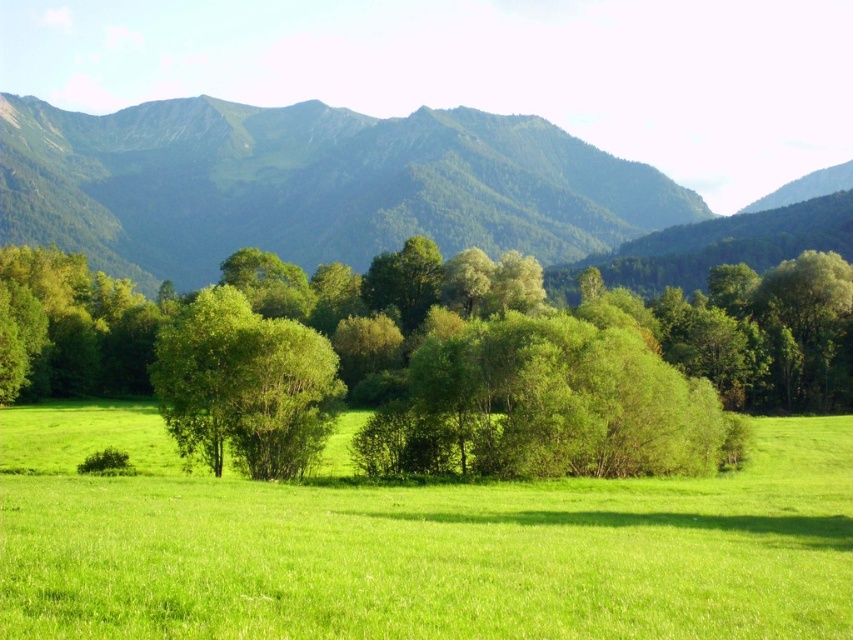
You are standing at the bottom left corner of the image. Looking towards the green leafy tree at center, in which general direction should you walk to reach it? Please choose from north, south, east, or west.

Since the green leafy tree at center is located at coordinates approximately halfway across the image horizontally and slightly below the vertical midpoint, if you are at the bottom left corner, you would need to walk northeast to reach it. However, based on standard image coordinate systems where the origin is typically at the top left, the tree is at x 0.58, y 0.518. In this case, moving from the bottom left corner, which is coordinate approximately near the bottom left, you would move towards the center.

Looking at this image, you are standing in the meadow and want to take a photo of both the green leafy tree at center and the green textured mountain range at upper center. Can you fit both in the frame without moving your camera position?

The green leafy tree at center is not as tall as the green textured mountain range at upper center, so yes, you can fit both in the frame since the tree is shorter and the mountain is taller, allowing them to be captured together.

You are standing at the origin point in the image. A green grass pasture at center is located at point (416, 545). Which direction should you move to reach the green grass pasture at center from your current position?

The green grass pasture at center is located at point (416, 545), so you should move towards that coordinate to reach it.